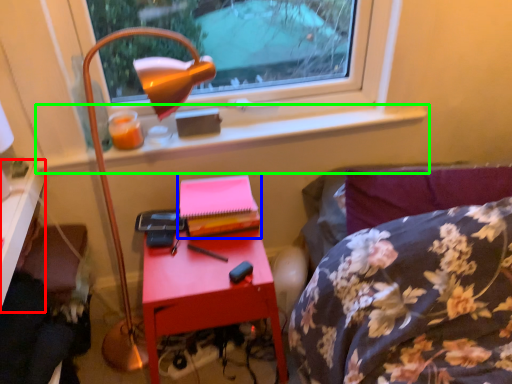
Question: Estimate the real-world distances between objects in this image. Which object is closer to desk (highlighted by a red box), paperback book (highlighted by a blue box) or window sill (highlighted by a green box)?

Choices:
 (A) paperback book
 (B) window sill

Answer: (B)